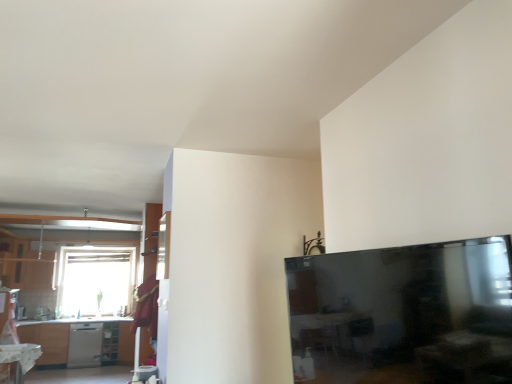
Question: From a real-world perspective, is white glossy table at lower left positioned above or below satin silver dishwasher at lower left?

Choices:
 (A) above
 (B) below

Answer: (A)

Question: Is white glossy table at lower left inside the boundaries of satin silver dishwasher at lower left, or outside?

Choices:
 (A) inside
 (B) outside

Answer: (B)

Question: Which object is positioned closest to the matte wood cabinet at left?

Choices:
 (A) white glossy table at lower left
 (B) transparent glass window at upper left
 (C) satin silver dishwasher at lower left
 (D) matte white shelf at lower left

Answer: (B)

Question: Which of these objects is positioned farthest from the transparent glass window at upper left?

Choices:
 (A) satin silver dishwasher at lower left
 (B) matte white shelf at lower left
 (C) matte wood cabinet at left
 (D) white glossy table at lower left

Answer: (D)